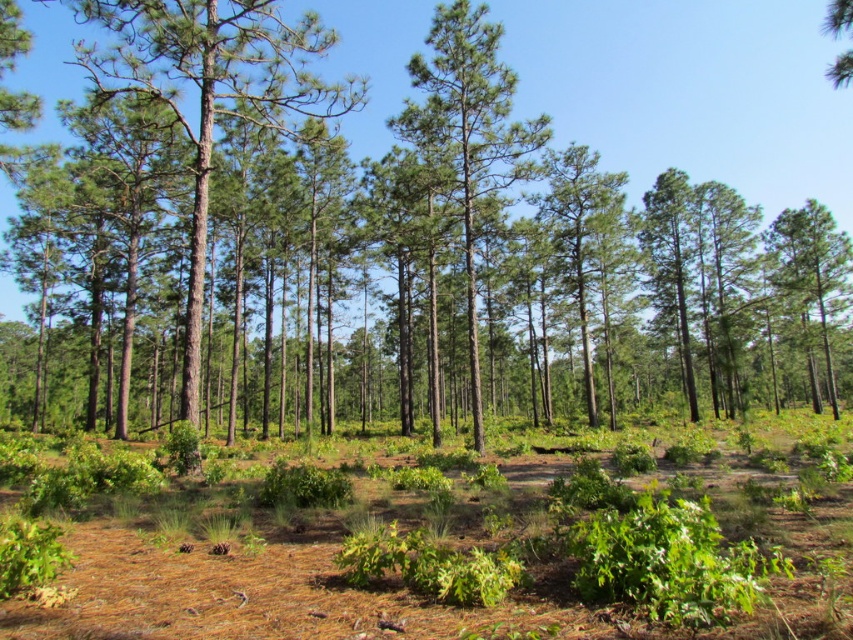
Question: Which of the following is the farthest from the observer?

Choices:
 (A) green textured tree at center
 (B) green matte tree at right
 (C) green rough bark tree at center
 (D) green matte tree at center

Answer: (B)

Question: Can you confirm if green rough bark tree at center is wider than green matte tree at center?

Choices:
 (A) yes
 (B) no

Answer: (A)

Question: Can you confirm if green textured tree at center is positioned to the left of green matte tree at center?

Choices:
 (A) yes
 (B) no

Answer: (B)

Question: Can you confirm if green textured tree at center is smaller than green matte tree at right?

Choices:
 (A) yes
 (B) no

Answer: (B)

Question: Which of the following is the closest to the observer?

Choices:
 (A) green matte tree at center
 (B) green textured tree at center
 (C) green rough bark tree at center

Answer: (C)

Question: Which point is closer to the camera?

Choices:
 (A) (833, 284)
 (B) (223, 80)

Answer: (B)